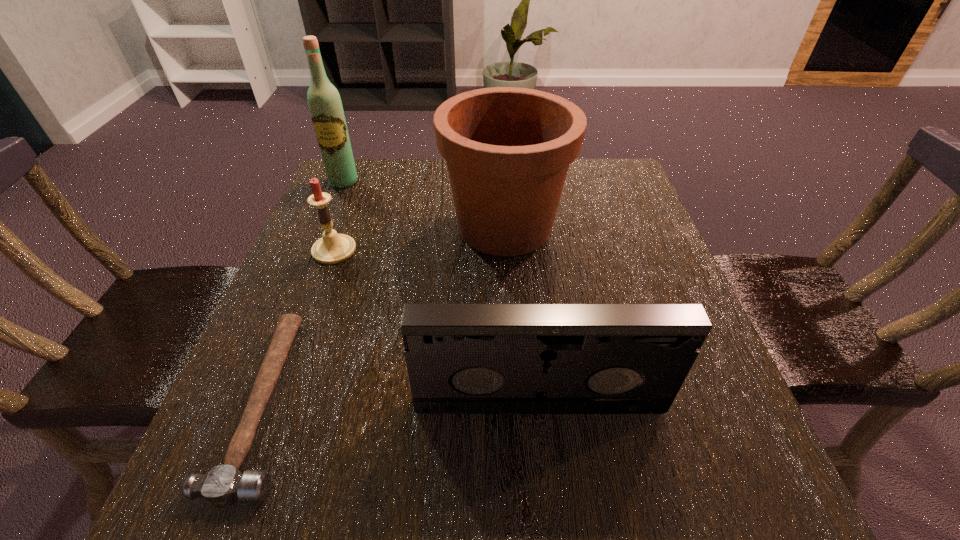
Locate an element on the screen. The height and width of the screenshot is (540, 960). the tallest object is located at coordinates (325, 105).

At what (x,y) coordinates should I click in order to perform the action: click on wine bottle. Please return your answer as a coordinate pair (x, y). The height and width of the screenshot is (540, 960). Looking at the image, I should click on (325, 105).

The width and height of the screenshot is (960, 540). What are the coordinates of `the second tallest object` in the screenshot? It's located at (508, 150).

Find the location of a particular element. The image size is (960, 540). videotape is located at coordinates (461, 358).

The image size is (960, 540). Find the location of `the fourth tallest object`. the fourth tallest object is located at coordinates (332, 248).

Image resolution: width=960 pixels, height=540 pixels. I want to click on hammer, so click(223, 485).

At what (x,y) coordinates should I click in order to perform the action: click on free spot located on the front-facing side of the wine bottle. Please return your answer as a coordinate pair (x, y). The height and width of the screenshot is (540, 960). Looking at the image, I should click on (310, 264).

Locate an element on the screen. The image size is (960, 540). vacant space situated 0.100m on the front of the flowerpot is located at coordinates (510, 306).

Image resolution: width=960 pixels, height=540 pixels. In order to click on free space located 0.050m on the front side of the third tallest object in this screenshot , I will do pos(544,446).

Locate an element on the screen. The image size is (960, 540). vacant space located 0.120m on the front of the second shortest object is located at coordinates (313, 308).